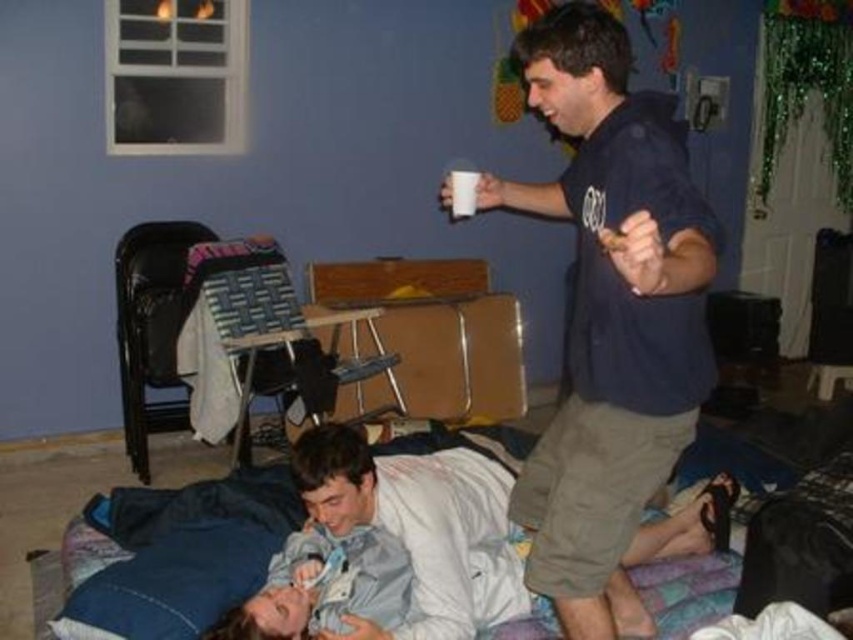
In the scene shown: Which is below, dark blue shirt at upper right or denim fabric bed at lower center?

denim fabric bed at lower center

Is dark blue shirt at upper right smaller than denim fabric bed at lower center?

No.

Is point (582, 49) farther from camera compared to point (189, 580)?

No, (582, 49) is in front of (189, 580).

Locate an element on the screen. Image resolution: width=853 pixels, height=640 pixels. dark blue shirt at upper right is located at coordinates (610, 316).